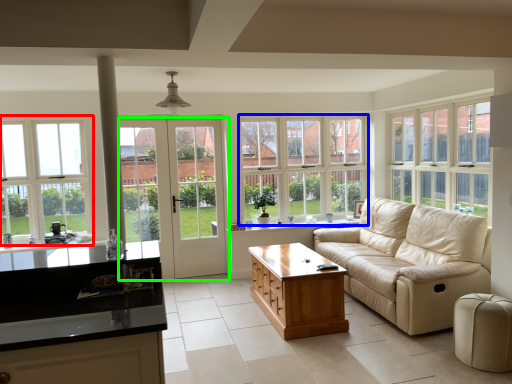
Question: Which is nearer to the window (highlighted by a red box)? window (highlighted by a blue box) or door (highlighted by a green box).

Choices:
 (A) window
 (B) door

Answer: (B)